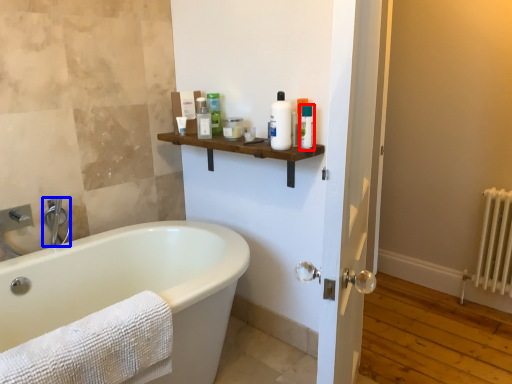
Question: Among these objects, which one is farthest to the camera, toiletry (highlighted by a red box) or faucet (highlighted by a blue box)?

Choices:
 (A) toiletry
 (B) faucet

Answer: (B)